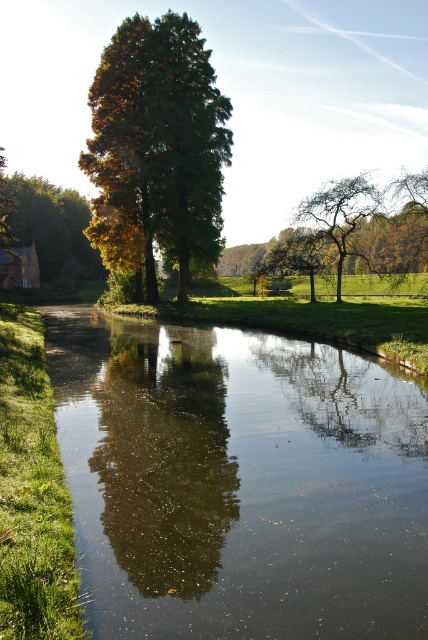
Is point (294, 531) positioned behind point (323, 189)?

No, it is in front of (323, 189).

Who is shorter, smooth reflective water at center or green matte tree at upper center?

With less height is smooth reflective water at center.

Identify the location of smooth reflective water at center. The width and height of the screenshot is (428, 640). (238, 483).

Is point (121, 330) behind point (130, 115)?

No, (121, 330) is in front of (130, 115).

Which is in front, point (157, 388) or point (196, 234)?

Point (157, 388) is in front.

Where is `smooth reflective water at center`? smooth reflective water at center is located at coordinates (238, 483).

Does green matte tree at center have a larger size compared to green matte tree at upper center?

Actually, green matte tree at center might be smaller than green matte tree at upper center.

Does point (154, 291) come farther from viewer compared to point (338, 198)?

Yes, point (154, 291) is farther from viewer.

Locate an element on the screen. This screenshot has height=640, width=428. green matte tree at center is located at coordinates (157, 147).